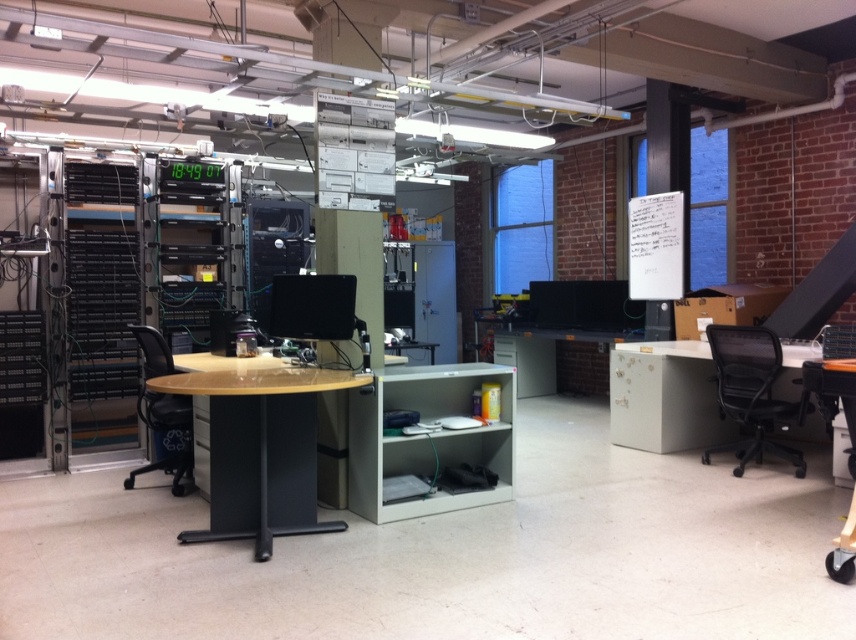
Consider the image. Is light brown glossy table at center wider than white matte table at right?

Correct, the width of light brown glossy table at center exceeds that of white matte table at right.

Can you confirm if light brown glossy table at center is shorter than white matte table at right?

Incorrect, light brown glossy table at center's height does not fall short of white matte table at right's.

Who is more forward, (308, 432) or (645, 394)?

Point (308, 432) is more forward.

Where is `light brown glossy table at center`? light brown glossy table at center is located at coordinates (260, 449).

Who is positioned more to the left, light brown glossy table at center or black mesh office chair at right?

light brown glossy table at center

Who is more forward, (276, 436) or (720, 376)?

Point (276, 436) is more forward.

Describe the element at coordinates (260, 449) in the screenshot. I see `light brown glossy table at center` at that location.

I want to click on light brown glossy table at center, so pyautogui.click(x=260, y=449).

Is black mesh office chair at right to the right of black mesh office chair at left from the viewer's perspective?

Correct, you'll find black mesh office chair at right to the right of black mesh office chair at left.

Is black mesh office chair at right above black mesh office chair at left?

Incorrect, black mesh office chair at right is not positioned above black mesh office chair at left.

Which is in front, point (764, 380) or point (170, 358)?

Point (170, 358) is in front.

Locate an element on the screen. black mesh office chair at right is located at coordinates (752, 394).